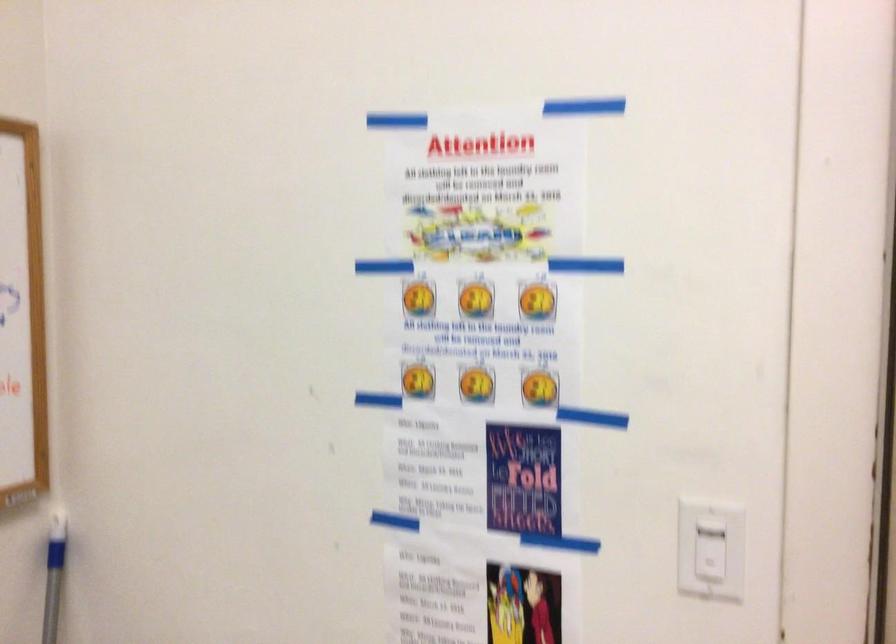
This screenshot has width=896, height=644. What do you see at coordinates (710, 550) in the screenshot? I see `the white light switch` at bounding box center [710, 550].